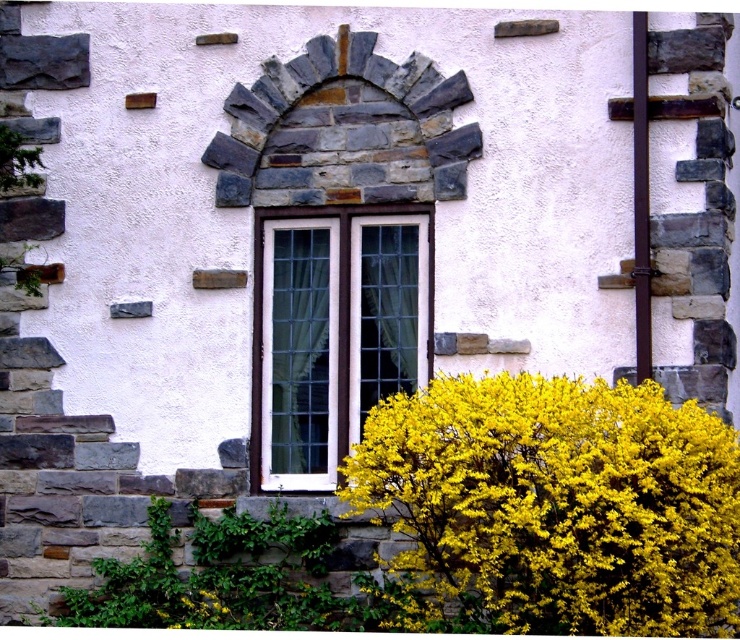
Question: Which of the following is the closest to the observer?

Choices:
 (A) (568, 381)
 (B) (374, 394)

Answer: (A)

Question: Is yellow fluffy bush at lower right thinner than white glass window at center?

Choices:
 (A) yes
 (B) no

Answer: (B)

Question: Which object is farther from the camera taking this photo?

Choices:
 (A) yellow fluffy bush at lower right
 (B) white glass window at center

Answer: (B)

Question: Is yellow fluffy bush at lower right bigger than white glass window at center?

Choices:
 (A) no
 (B) yes

Answer: (B)

Question: Observing the image, what is the correct spatial positioning of yellow fluffy bush at lower right in reference to white glass window at center?

Choices:
 (A) right
 (B) left

Answer: (A)